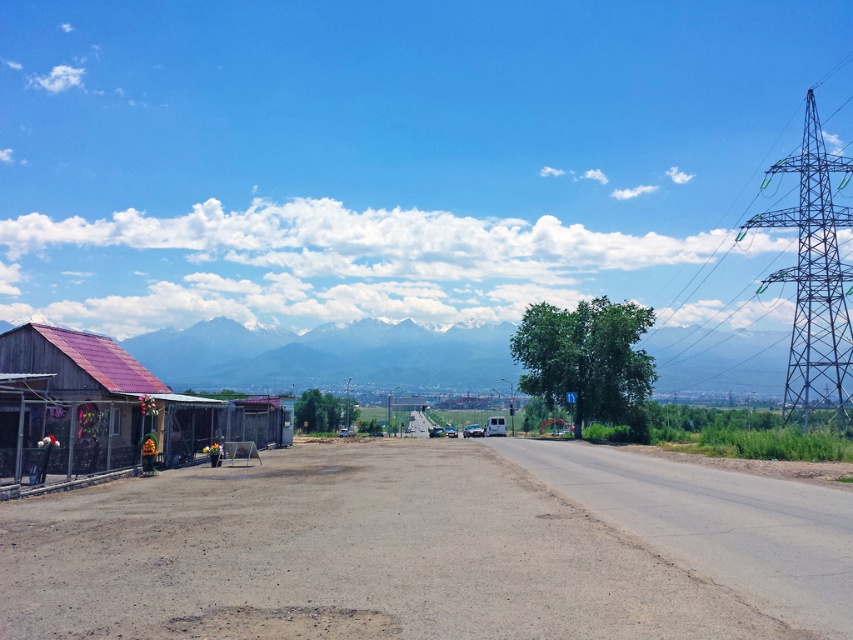
Question: Which of the following is the farthest from the observer?

Choices:
 (A) metallic grid structure at right
 (B) metallic corrugated roof hut at left
 (C) dusty asphalt road at lower left

Answer: (A)

Question: Is dusty asphalt road at lower left closer to the viewer compared to metallic corrugated roof hut at left?

Choices:
 (A) yes
 (B) no

Answer: (A)

Question: Can you confirm if white snow-covered mountain at center is positioned to the right of metallic corrugated roof hut at left?

Choices:
 (A) yes
 (B) no

Answer: (A)

Question: Among these points, which one is farthest from the camera?

Choices:
 (A) (187, 333)
 (B) (830, 228)

Answer: (A)

Question: Which object is farther from the camera taking this photo?

Choices:
 (A) metallic corrugated roof hut at left
 (B) metallic grid structure at right

Answer: (B)

Question: Does white snow-covered mountain at center appear on the right side of metallic corrugated roof hut at left?

Choices:
 (A) no
 (B) yes

Answer: (B)